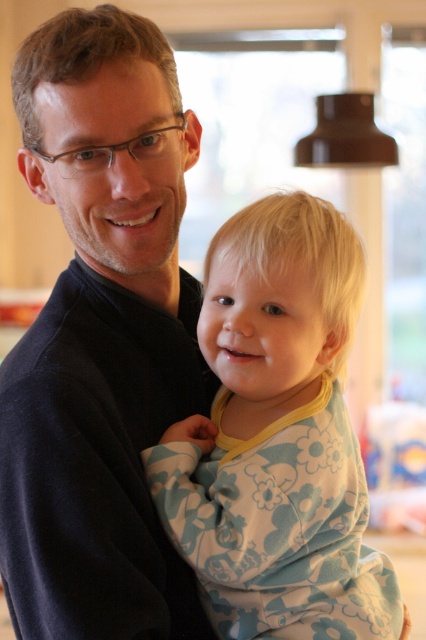
I want to click on dark blue sweater at center, so [x=100, y=339].

Based on the photo, between dark blue sweater at center and fluffy cotton onesie at center, which one has more height?

Standing taller between the two is dark blue sweater at center.

What do you see at coordinates (100, 339) in the screenshot?
I see `dark blue sweater at center` at bounding box center [100, 339].

This screenshot has width=426, height=640. Find the location of `dark blue sweater at center`. dark blue sweater at center is located at coordinates (100, 339).